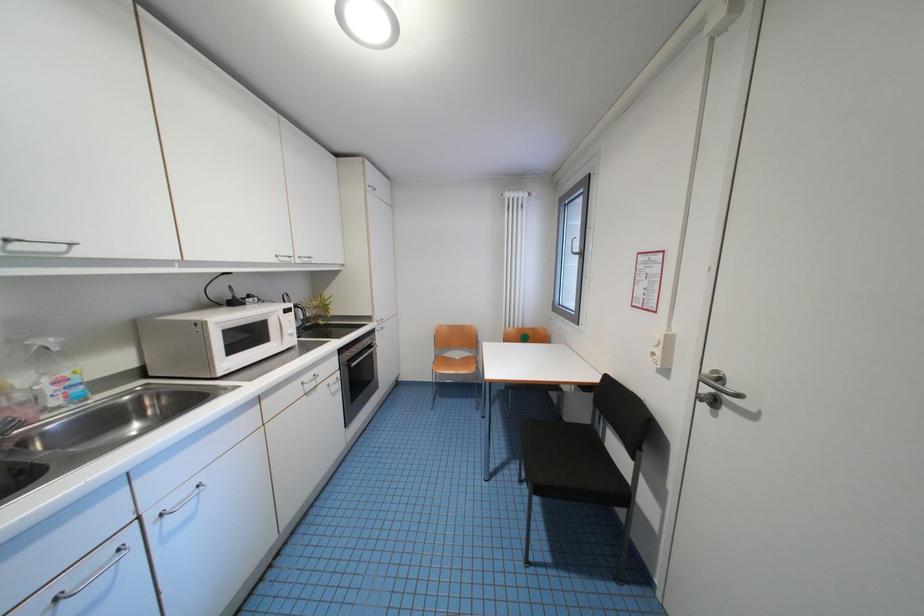
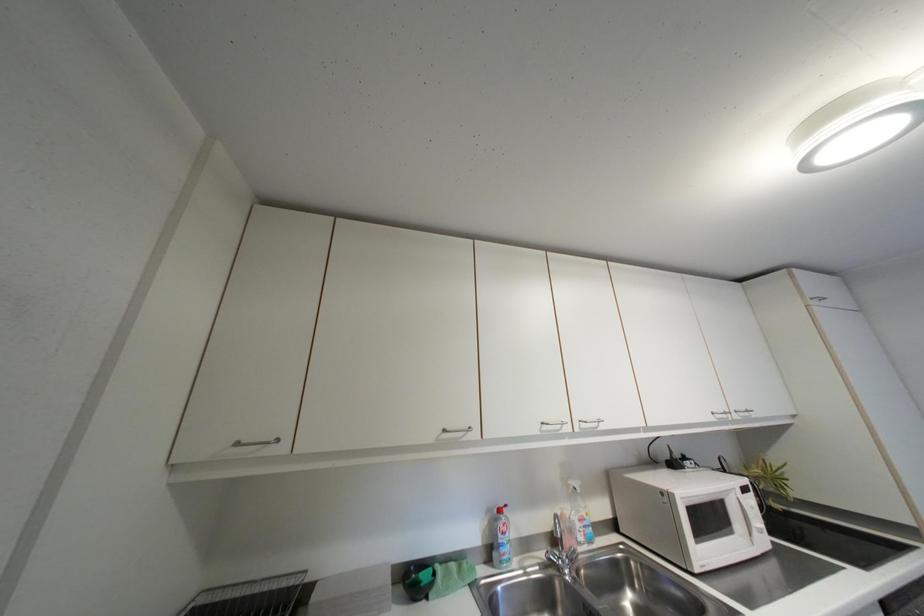
The first image is from the beginning of the video and the second image is from the end. How did the camera likely rotate when shooting the video?

The rotation direction of the camera is left-up.